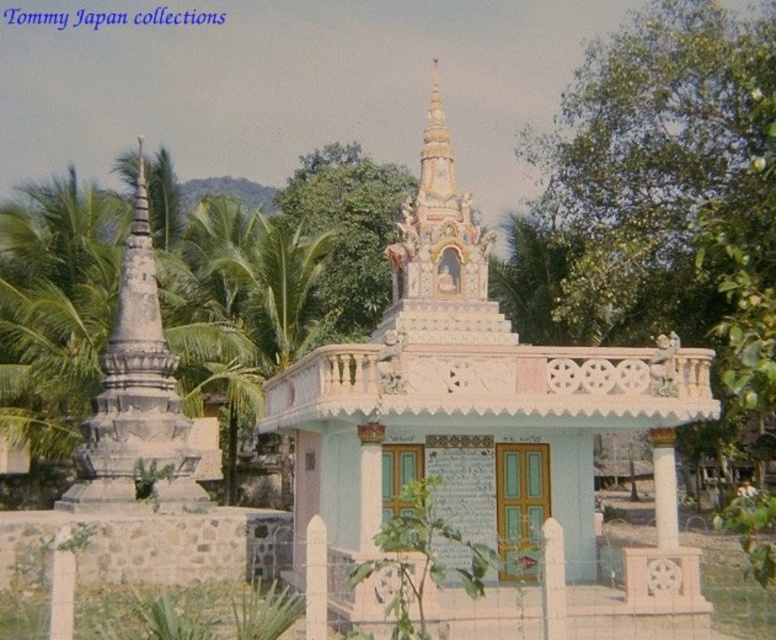
Question: In this image, where is green leafy tree at upper center located relative to green leafy palm tree at center?

Choices:
 (A) above
 (B) below

Answer: (A)

Question: Which point is farther to the camera?

Choices:
 (A) (736, 442)
 (B) (345, 276)
 (C) (262, 316)

Answer: (B)

Question: Can you confirm if green leafy tree at upper center is smaller than green leafy palm tree at center?

Choices:
 (A) no
 (B) yes

Answer: (A)

Question: Which point is farther to the camera?

Choices:
 (A) green leafy palm tree at center
 (B) green leafy tree at upper center
 (C) green leafy tree at center

Answer: (B)

Question: Which object is the farthest from the green leafy palm tree at center?

Choices:
 (A) green leafy tree at upper center
 (B) green leafy tree at center

Answer: (B)

Question: From the image, what is the correct spatial relationship of green leafy tree at center in relation to green leafy palm tree at center?

Choices:
 (A) below
 (B) above

Answer: (A)